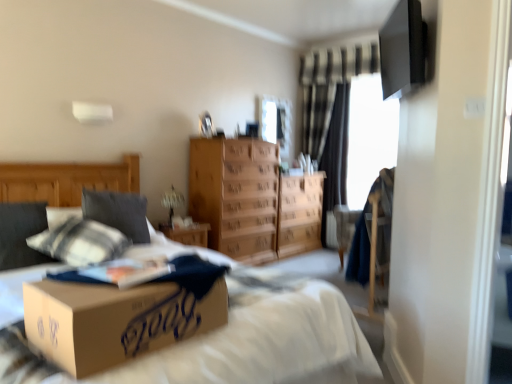
Image resolution: width=512 pixels, height=384 pixels. What do you see at coordinates (369, 137) in the screenshot?
I see `transparent glass window screen at upper right, positioned as the 1th window screen in right-to-left order` at bounding box center [369, 137].

Measure the distance between point (326, 178) and camera.

Point (326, 178) is 5.35 meters from camera.

Locate an element on the screen. Image resolution: width=512 pixels, height=384 pixels. soft gray pillow at left is located at coordinates (21, 234).

You are a GUI agent. You are given a task and a screenshot of the screen. Output one action in this format:
    pyautogui.click(x=<x>, y=<y>)
    Task: Click on the wooden dresser at center
    
    Given the screenshot: What is the action you would take?
    pyautogui.click(x=300, y=214)

Is light brown wood chest of drawers at center oriented towards brown cardboard box at center?

No, light brown wood chest of drawers at center is not facing towards brown cardboard box at center.

Considering the positions of objects light brown wood chest of drawers at center and brown cardboard box at center in the image provided, who is more to the left, light brown wood chest of drawers at center or brown cardboard box at center?

From the viewer's perspective, brown cardboard box at center appears more on the left side.

Where is `bed on the left of light brown wood chest of drawers at center`? This screenshot has width=512, height=384. bed on the left of light brown wood chest of drawers at center is located at coordinates (267, 343).

Is point (234, 194) less distant than point (298, 350)?

No, (234, 194) is further to viewer.

Does black textured curtain at center have a larger size compared to transparent glass window screen at upper right, positioned as the 1th window screen in right-to-left order?

Indeed, black textured curtain at center has a larger size compared to transparent glass window screen at upper right, positioned as the 1th window screen in right-to-left order.

Considering the sizes of objects black textured curtain at center and transparent glass window screen at upper right, positioned as the 1th window screen in right-to-left order, in the image provided, who is taller, black textured curtain at center or transparent glass window screen at upper right, positioned as the 1th window screen in right-to-left order,?

Standing taller between the two is black textured curtain at center.

Between point (326, 241) and point (350, 203), which one is positioned behind?

The point (350, 203) is farther from the camera.

From the image's perspective, does clear glass window screen at upper center, marked as the 2th window screen in a right-to-left arrangement, appear lower than black textured curtain at center?

Incorrect, from the image's perspective, clear glass window screen at upper center, marked as the 2th window screen in a right-to-left arrangement, is higher than black textured curtain at center.

Does clear glass window screen at upper center, the 1th window screen positioned from the left, appear on the right side of black textured curtain at center?

No, clear glass window screen at upper center, the 1th window screen positioned from the left, is not to the right of black textured curtain at center.

How different are the orientations of clear glass window screen at upper center, marked as the 2th window screen in a right-to-left arrangement, and black textured curtain at center in degrees?

The angular difference between clear glass window screen at upper center, marked as the 2th window screen in a right-to-left arrangement, and black textured curtain at center is 91.2 degrees.

Considering the relative sizes of clear glass window screen at upper center, the 1th window screen positioned from the left, and black textured curtain at center in the image provided, is clear glass window screen at upper center, the 1th window screen positioned from the left, thinner than black textured curtain at center?

Correct, the width of clear glass window screen at upper center, the 1th window screen positioned from the left, is less than that of black textured curtain at center.

Which object is closer to the camera, wooden dresser at center or transparent glass window screen at upper right, positioned as the 1th window screen in right-to-left order?

wooden dresser at center is closer to the camera.

Considering the relative positions of wooden dresser at center and transparent glass window screen at upper right, positioned as the 1th window screen in right-to-left order, in the image provided, is wooden dresser at center to the left of transparent glass window screen at upper right, positioned as the 1th window screen in right-to-left order, from the viewer's perspective?

Yes, wooden dresser at center is to the left of transparent glass window screen at upper right, positioned as the 1th window screen in right-to-left order.

From the image's perspective, between wooden dresser at center and transparent glass window screen at upper right, positioned as the 1th window screen in right-to-left order, which one is located above?

transparent glass window screen at upper right, positioned as the 1th window screen in right-to-left order, is shown above in the image.

Is wooden dresser at center far from transparent glass window screen at upper right, the second window screen positioned from the left?

No, wooden dresser at center is in close proximity to transparent glass window screen at upper right, the second window screen positioned from the left.

Between black textured curtain at center and brown cardboard box at center, which one has larger size?

brown cardboard box at center is bigger.

Considering the relative sizes of black textured curtain at center and brown cardboard box at center in the image provided, is black textured curtain at center taller than brown cardboard box at center?

Yes, black textured curtain at center is taller than brown cardboard box at center.

This screenshot has height=384, width=512. In the image, there is a black textured curtain at center. In order to click on bed below it (from a real-world perspective) in this screenshot , I will do `click(267, 343)`.

Considering the positions of objects black textured curtain at center and brown cardboard box at center in the image provided, who is more to the left, black textured curtain at center or brown cardboard box at center?

brown cardboard box at center.

From a real-world perspective, which object stands above the other?

clear glass window screen at upper center, the 1th window screen positioned from the left, from a real-world perspective.

Is wooden dresser at center not near clear glass window screen at upper center, the 1th window screen positioned from the left?

wooden dresser at center is actually quite close to clear glass window screen at upper center, the 1th window screen positioned from the left.

Considering the points (314, 210) and (260, 100), which point is in front, point (314, 210) or point (260, 100)?

The point (260, 100) is closer.

Can you confirm if wooden dresser at center is smaller than clear glass window screen at upper center, marked as the 2th window screen in a right-to-left arrangement?

Incorrect, wooden dresser at center is not smaller in size than clear glass window screen at upper center, marked as the 2th window screen in a right-to-left arrangement.

Is black textured curtain at center directly adjacent to clear glass window screen at upper center, marked as the 2th window screen in a right-to-left arrangement?

No.

Is black textured curtain at center wider or thinner than clear glass window screen at upper center, the 1th window screen positioned from the left?

Considering their sizes, black textured curtain at center looks broader than clear glass window screen at upper center, the 1th window screen positioned from the left.

From a real-world perspective, is black textured curtain at center physically above clear glass window screen at upper center, marked as the 2th window screen in a right-to-left arrangement?

No, from a real-world perspective, black textured curtain at center is not above clear glass window screen at upper center, marked as the 2th window screen in a right-to-left arrangement.

In the image, is black textured curtain at center positioned in front of or behind clear glass window screen at upper center, marked as the 2th window screen in a right-to-left arrangement?

black textured curtain at center is positioned farther from the viewer than clear glass window screen at upper center, marked as the 2th window screen in a right-to-left arrangement.

You are a GUI agent. You are given a task and a screenshot of the screen. Output one action in this format:
    pyautogui.click(x=<x>, y=<y>)
    Task: Click on the bed below the light brown wood chest of drawers at center (from a real-world perspective)
    The width and height of the screenshot is (512, 384).
    Given the screenshot: What is the action you would take?
    pyautogui.click(x=267, y=343)

Image resolution: width=512 pixels, height=384 pixels. I want to click on curtain that appears below the transparent glass window screen at upper right, the second window screen positioned from the left (from the image's perspective), so click(335, 156).

From the picture: Based on their spatial positions, is clear glass window screen at upper center, marked as the 2th window screen in a right-to-left arrangement, or soft gray pillow at left further from wooden dresser at center?

soft gray pillow at left lies further to wooden dresser at center than the other object.

Which object lies nearer to the anchor point soft gray pillow at left, clear glass window screen at upper center, the 1th window screen positioned from the left, or brown cardboard box at center?

brown cardboard box at center is closer to soft gray pillow at left.

From the image, which object appears to be farther from clear glass window screen at upper center, marked as the 2th window screen in a right-to-left arrangement, wooden dresser at center or brown cardboard box at center?

brown cardboard box at center lies further to clear glass window screen at upper center, marked as the 2th window screen in a right-to-left arrangement, than the other object.

Considering their positions, is black textured curtain at center positioned closer to transparent glass window screen at upper right, positioned as the 1th window screen in right-to-left order, than clear glass window screen at upper center, the 1th window screen positioned from the left?

Among the two, black textured curtain at center is located nearer to transparent glass window screen at upper right, positioned as the 1th window screen in right-to-left order.

From the image, which object appears to be farther from clear glass window screen at upper center, marked as the 2th window screen in a right-to-left arrangement, light brown wood chest of drawers at center or soft gray pillow at left?

Based on the image, soft gray pillow at left appears to be further to clear glass window screen at upper center, marked as the 2th window screen in a right-to-left arrangement.

From the image, which object appears to be farther from black textured curtain at center, light brown wood chest of drawers at center or soft gray pillow at left?

Based on the image, soft gray pillow at left appears to be further to black textured curtain at center.

Estimate the real-world distances between objects in this image. Which object is closer to soft gray pillow at left, transparent glass window screen at upper right, positioned as the 1th window screen in right-to-left order, or clear glass window screen at upper center, the 1th window screen positioned from the left?

Based on the image, clear glass window screen at upper center, the 1th window screen positioned from the left, appears to be nearer to soft gray pillow at left.

Considering their positions, is wooden dresser at center positioned closer to soft gray pillow at left than black textured curtain at center?

wooden dresser at center is closer to soft gray pillow at left.

Where is `the chest of drawers positioned between brown cardboard box at center and wooden dresser at center from near to far`? Image resolution: width=512 pixels, height=384 pixels. the chest of drawers positioned between brown cardboard box at center and wooden dresser at center from near to far is located at coordinates (253, 200).

The height and width of the screenshot is (384, 512). What are the coordinates of `curtain between light brown wood chest of drawers at center and transparent glass window screen at upper right, the second window screen positioned from the left` in the screenshot? It's located at (335, 156).

Find the location of `the chest of drawers situated between soft gray pillow at left and transparent glass window screen at upper right, positioned as the 1th window screen in right-to-left order, from left to right`. the chest of drawers situated between soft gray pillow at left and transparent glass window screen at upper right, positioned as the 1th window screen in right-to-left order, from left to right is located at coordinates (253, 200).

The width and height of the screenshot is (512, 384). In order to click on the chest of drawers positioned between soft gray pillow at left and black textured curtain at center from near to far in this screenshot , I will do click(x=253, y=200).